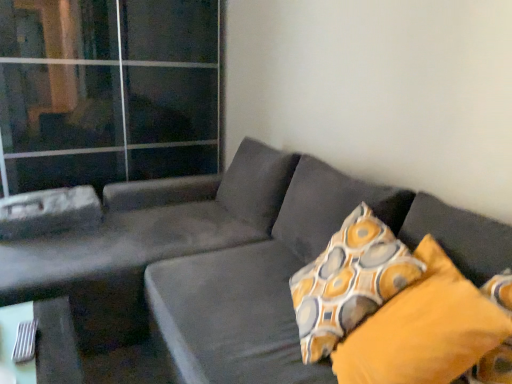
Question: Is patterned fabric pillow at right, which is counted as the 1th pillow, starting from the back, shorter than velvet dark gray couch at center?

Choices:
 (A) no
 (B) yes

Answer: (B)

Question: Is patterned fabric pillow at right, placed as the 2th pillow when sorted from front to back, next to velvet dark gray couch at center?

Choices:
 (A) yes
 (B) no

Answer: (B)

Question: Can you confirm if patterned fabric pillow at right, which is counted as the 1th pillow, starting from the back, is positioned to the right of velvet dark gray couch at center?

Choices:
 (A) no
 (B) yes

Answer: (B)

Question: Can you confirm if patterned fabric pillow at right, which is counted as the 1th pillow, starting from the back, is positioned to the left of velvet dark gray couch at center?

Choices:
 (A) yes
 (B) no

Answer: (B)

Question: From the image's perspective, is patterned fabric pillow at right, placed as the 2th pillow when sorted from front to back, on velvet dark gray couch at center?

Choices:
 (A) no
 (B) yes

Answer: (B)

Question: Is velvet dark gray couch at center bigger or smaller than transparent glass door at upper left?

Choices:
 (A) small
 (B) big

Answer: (B)

Question: Visually, is velvet dark gray couch at center positioned to the left or to the right of transparent glass door at upper left?

Choices:
 (A) left
 (B) right

Answer: (B)

Question: From the image's perspective, is velvet dark gray couch at center located above or below transparent glass door at upper left?

Choices:
 (A) below
 (B) above

Answer: (A)

Question: From a real-world perspective, is velvet dark gray couch at center positioned above or below transparent glass door at upper left?

Choices:
 (A) above
 (B) below

Answer: (B)

Question: Considering the relative positions of patterned fabric pillow at right, placed as the 2th pillow when sorted from front to back, and yellow fabric pillow at right, which is the 1th pillow from front to back, in the image provided, is patterned fabric pillow at right, placed as the 2th pillow when sorted from front to back, to the left or to the right of yellow fabric pillow at right, which is the 1th pillow from front to back,?

Choices:
 (A) right
 (B) left

Answer: (B)

Question: Looking at their shapes, would you say patterned fabric pillow at right, placed as the 2th pillow when sorted from front to back, is wider or thinner than yellow fabric pillow at right, marked as the 2th pillow in a back-to-front arrangement?

Choices:
 (A) wide
 (B) thin

Answer: (B)

Question: From a real-world perspective, is patterned fabric pillow at right, which is counted as the 1th pillow, starting from the back, above or below yellow fabric pillow at right, which is the 1th pillow from front to back?

Choices:
 (A) above
 (B) below

Answer: (B)

Question: Which is correct: patterned fabric pillow at right, placed as the 2th pillow when sorted from front to back, is inside yellow fabric pillow at right, which is the 1th pillow from front to back, or outside of it?

Choices:
 (A) inside
 (B) outside

Answer: (B)

Question: In terms of height, does patterned fabric pillow at right, placed as the 2th pillow when sorted from front to back, look taller or shorter compared to velvet dark gray couch at center?

Choices:
 (A) short
 (B) tall

Answer: (A)

Question: Is patterned fabric pillow at right, placed as the 2th pillow when sorted from front to back, wider or thinner than velvet dark gray couch at center?

Choices:
 (A) thin
 (B) wide

Answer: (A)